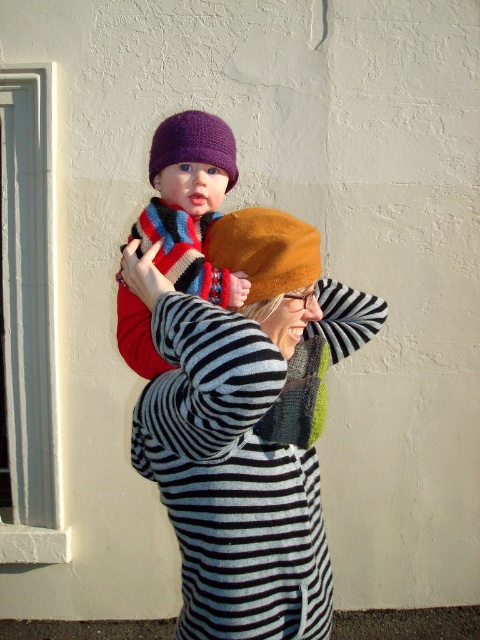
Is brown felt beret at center below knitted wool scarf at upper center?

Incorrect, brown felt beret at center is not positioned below knitted wool scarf at upper center.

Which is behind, point (302, 248) or point (184, 262)?

The point (184, 262) is more distant.

Between point (231, 264) and point (204, 259), which one is positioned behind?

The point (204, 259) is behind.

What are the coordinates of `brown felt beret at center` in the screenshot? It's located at (264, 250).

Can you confirm if striped knit sweater at center is shorter than purple crocheted hat at upper center?

No, striped knit sweater at center is not shorter than purple crocheted hat at upper center.

Who is positioned more to the left, striped knit sweater at center or purple crocheted hat at upper center?

From the viewer's perspective, purple crocheted hat at upper center appears more on the left side.

At what (x,y) coordinates should I click in order to perform the action: click on striped knit sweater at center. Please return your answer as a coordinate pair (x, y). Looking at the image, I should click on (242, 428).

The height and width of the screenshot is (640, 480). What are the coordinates of `striped knit sweater at center` in the screenshot? It's located at (242, 428).

Who is higher up, brown felt beret at center or green knitted scarf at center?

Positioned higher is brown felt beret at center.

Is the position of brown felt beret at center less distant than that of green knitted scarf at center?

No, brown felt beret at center is behind green knitted scarf at center.

Image resolution: width=480 pixels, height=640 pixels. What do you see at coordinates (264, 250) in the screenshot?
I see `brown felt beret at center` at bounding box center [264, 250].

Where is `brown felt beret at center`? Image resolution: width=480 pixels, height=640 pixels. brown felt beret at center is located at coordinates (264, 250).